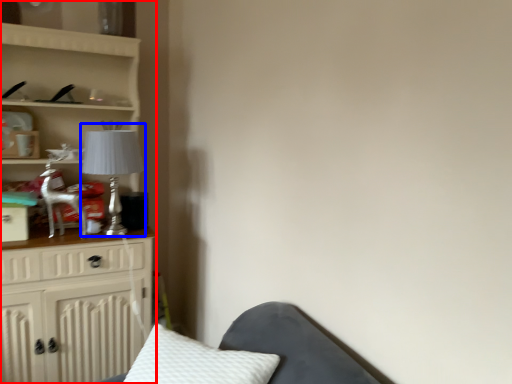
Question: Which point is further to the camera, furniture (highlighted by a red box) or table lamp (highlighted by a blue box)?

Choices:
 (A) furniture
 (B) table lamp

Answer: (B)